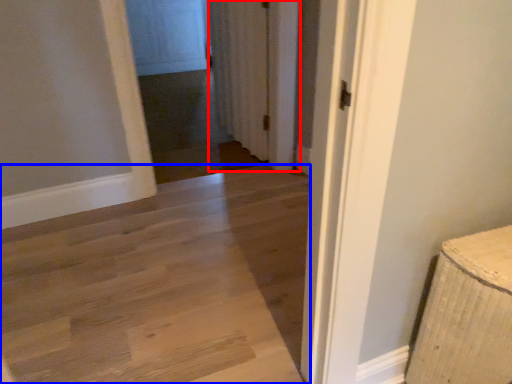
Question: Which of the following is the closest to the observer, curtain (highlighted by a red box) or path (highlighted by a blue box)?

Choices:
 (A) curtain
 (B) path

Answer: (B)